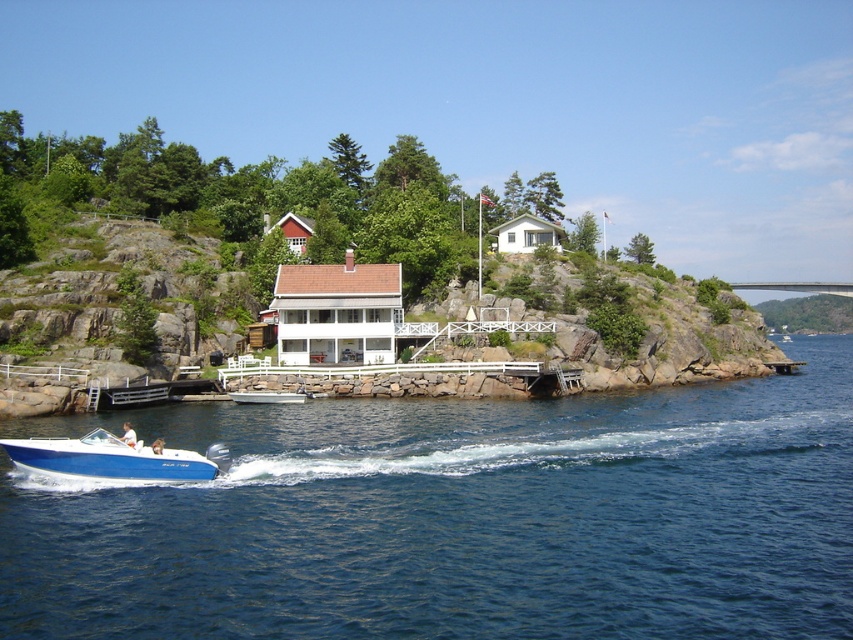
Is blue liquid water at lower center shorter than blue glossy boat at lower left?

Correct, blue liquid water at lower center is not as tall as blue glossy boat at lower left.

Is blue liquid water at lower center above blue glossy boat at lower left?

No, blue liquid water at lower center is not above blue glossy boat at lower left.

Locate an element on the screen. blue liquid water at lower center is located at coordinates (463, 518).

In the scene shown: Does blue liquid water at lower center appear under white plastic boat at center?

Indeed, blue liquid water at lower center is positioned under white plastic boat at center.

Locate an element on the screen. This screenshot has height=640, width=853. blue liquid water at lower center is located at coordinates (463, 518).

Find the location of a particular element. The height and width of the screenshot is (640, 853). blue liquid water at lower center is located at coordinates (463, 518).

Can you confirm if blue glossy boat at lower left is thinner than white plastic boat at center?

No.

Can you confirm if blue glossy boat at lower left is positioned below white plastic boat at center?

Yes.

Is point (96, 464) positioned after point (287, 397)?

No, it is not.

Identify the location of blue glossy boat at lower left. The height and width of the screenshot is (640, 853). (114, 458).